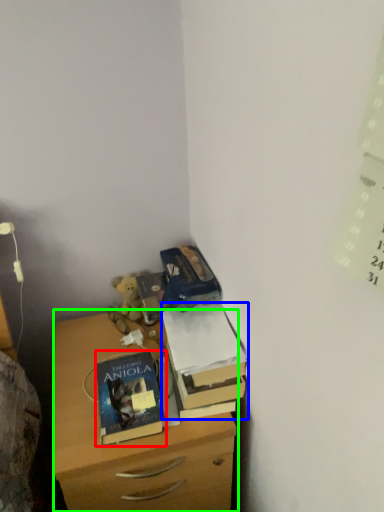
Question: Which object is positioned farthest from book (highlighted by a red box)? Select from box (highlighted by a blue box) and chest of drawers (highlighted by a green box).

Choices:
 (A) box
 (B) chest of drawers

Answer: (A)